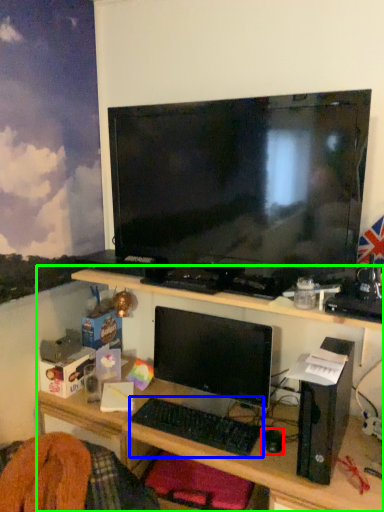
Question: Considering the real-world distances, which object is closest to mouse (highlighted by a red box)? computer keyboard (highlighted by a blue box) or desk (highlighted by a green box).

Choices:
 (A) computer keyboard
 (B) desk

Answer: (A)